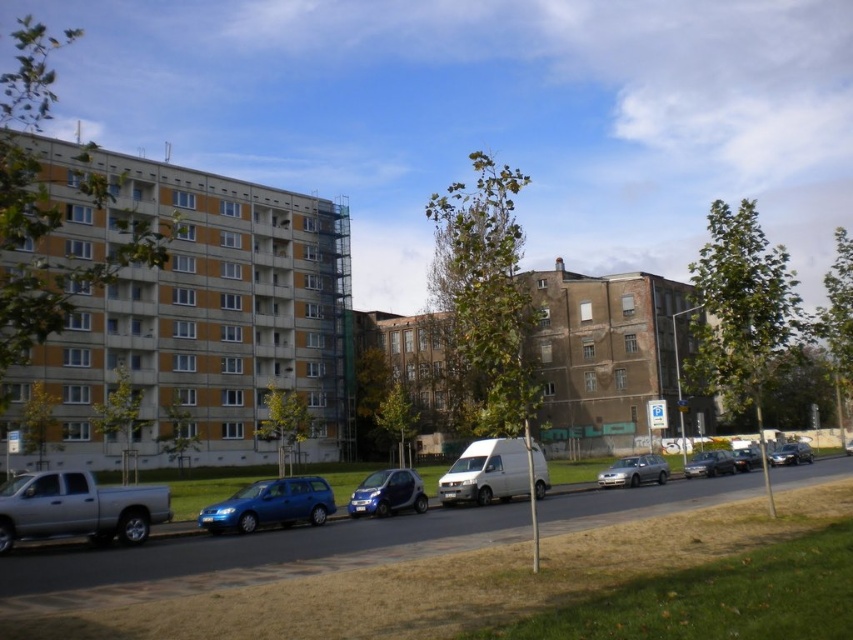
Question: Does metallic blue car at center lie in front of metallic silver sedan at center-right?

Choices:
 (A) yes
 (B) no

Answer: (A)

Question: Is metallic silver sedan at center to the left of metallic silver sedan at center-right from the viewer's perspective?

Choices:
 (A) yes
 (B) no

Answer: (A)

Question: Does metallic blue car at center come in front of metallic silver sedan at center?

Choices:
 (A) yes
 (B) no

Answer: (A)

Question: Among these objects, which one is farthest from the camera?

Choices:
 (A) satin blue station wagon at lower center
 (B) satin silver sedan at center
 (C) metallic blue car at center
 (D) metallic silver sedan at center

Answer: (D)

Question: Which point is farther to the camera?

Choices:
 (A) metallic blue car at center
 (B) shiny silver sedan at center right

Answer: (B)

Question: Which point is closer to the camera?

Choices:
 (A) (300, 496)
 (B) (807, 445)

Answer: (A)